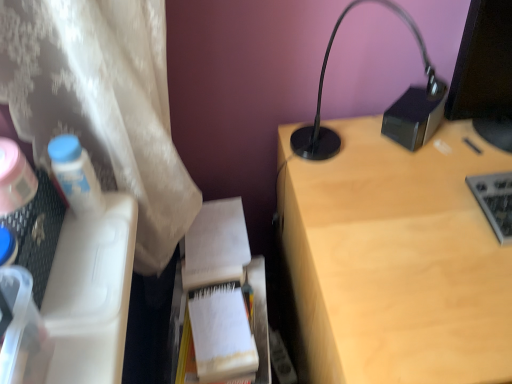
In order to face light wood desk at upper right, should I rotate leftwards or rightwards?

It's best to rotate right around 26.808 degrees.

What do you see at coordinates (485, 73) in the screenshot? I see `black glossy monitor at upper right` at bounding box center [485, 73].

Locate an element on the screen. This screenshot has height=384, width=512. white paper at center is located at coordinates (222, 333).

Describe the element at coordinates (76, 176) in the screenshot. I see `white plastic bottle at left` at that location.

The width and height of the screenshot is (512, 384). What are the coordinates of `light wood desk at upper right` in the screenshot? It's located at tap(395, 259).

Is light wood desk at upper right far away from white paper notebook at center?

They are positioned close to each other.

Which of these two, light wood desk at upper right or white paper notebook at center, is smaller?

white paper notebook at center.

Is light wood desk at upper right completely or partially outside of white paper notebook at center?

That's correct, light wood desk at upper right is outside of white paper notebook at center.

Which of these two, light wood desk at upper right or white paper notebook at center, stands shorter?

white paper notebook at center.

You are a GUI agent. You are given a task and a screenshot of the screen. Output one action in this format:
    pyautogui.click(x=<x>, y=<y>)
    Task: Click on the laptop keyboard below the black matte speaker at upper right (from a real-world perspective)
    Image resolution: width=512 pixels, height=384 pixels.
    Given the screenshot: What is the action you would take?
    pyautogui.click(x=495, y=201)

Consider the image. Is gray metallic keyboard at right completely or partially outside of black matte speaker at upper right?

Yes, gray metallic keyboard at right is outside of black matte speaker at upper right.

Is gray metallic keyboard at right positioned with its back to black matte speaker at upper right?

A: gray metallic keyboard at right is not turned away from black matte speaker at upper right.

Is point (472, 176) closer or farther from the camera than point (388, 110)?

Point (472, 176) is closer to the camera than point (388, 110).

In the scene shown: Can you confirm if white paper at center is positioned to the right of black matte speaker at upper right?

In fact, white paper at center is to the left of black matte speaker at upper right.

Are white paper at center and black matte speaker at upper right located far from each other?

No, white paper at center is in close proximity to black matte speaker at upper right.

Considering the relative sizes of white paper at center and black matte speaker at upper right in the image provided, is white paper at center shorter than black matte speaker at upper right?

Indeed, white paper at center has a lesser height compared to black matte speaker at upper right.

Considering the sizes of black matte speaker at upper right and gray metallic keyboard at right in the image, is black matte speaker at upper right taller or shorter than gray metallic keyboard at right?

Clearly, black matte speaker at upper right is taller compared to gray metallic keyboard at right.

In order to click on speaker located on the left of gray metallic keyboard at right in this screenshot , I will do `click(415, 116)`.

Can you tell me how much black matte speaker at upper right and gray metallic keyboard at right differ in facing direction?

40 degrees.

Which of these two, black matte speaker at upper right or gray metallic keyboard at right, is smaller?

With smaller size is black matte speaker at upper right.

Looking at this image, considering the relative positions of light wood desk at upper right and white paper at center in the image provided, is light wood desk at upper right to the right of white paper at center from the viewer's perspective?

Yes.

Can you tell me how much light wood desk at upper right and white paper at center differ in facing direction?

The angle between the facing direction of light wood desk at upper right and the facing direction of white paper at center is 2.84 degrees.

From a real-world perspective, is light wood desk at upper right on top of white paper at center?

No, from a real-world perspective, light wood desk at upper right is not over white paper at center

Looking at this image, from the image's perspective, is white paper at center positioned above or below light wood desk at upper right?

Clearly, from the image's perspective, white paper at center is below light wood desk at upper right.

From a real-world perspective, which is physically above, white paper at center or light wood desk at upper right?

white paper at center, from a real-world perspective.

Where is `paperback book below the light wood desk at upper right (from the image's perspective)`? This screenshot has width=512, height=384. paperback book below the light wood desk at upper right (from the image's perspective) is located at coordinates (222, 333).

Considering the points (229, 359) and (402, 261), which point is behind, point (229, 359) or point (402, 261)?

The point (229, 359) is behind.

Is white plastic bottle at left positioned behind black matte speaker at upper right?

No, the depth of white plastic bottle at left is less than that of black matte speaker at upper right.

Is black matte speaker at upper right surrounded by white plastic bottle at left?

No, black matte speaker at upper right is located outside of white plastic bottle at left.

How many degrees apart are the facing directions of white plastic bottle at left and black matte speaker at upper right?

The facing directions of white plastic bottle at left and black matte speaker at upper right are 50.9 degrees apart.

Looking at this image, is white plastic bottle at left wider or thinner than black matte speaker at upper right?

In the image, white plastic bottle at left appears to be more narrow than black matte speaker at upper right.

The image size is (512, 384). Find the location of `notebook lying above the light wood desk at upper right (from the image's perspective)`. notebook lying above the light wood desk at upper right (from the image's perspective) is located at coordinates (216, 245).

This screenshot has width=512, height=384. Find the location of `laptop keyboard that appears below the black matte speaker at upper right (from the image's perspective)`. laptop keyboard that appears below the black matte speaker at upper right (from the image's perspective) is located at coordinates (495, 201).

From the image, which object appears to be nearer to light wood desk at upper right, black metallic lamp at upper right or gray metallic keyboard at right?

black metallic lamp at upper right lies closer to light wood desk at upper right than the other object.

When comparing their distances from black glossy monitor at upper right, does gray metallic keyboard at right or black matte speaker at upper right seem further?

gray metallic keyboard at right.

Looking at the image, which one is located further to white plastic bottle at left, white paper at center or gray metallic keyboard at right?

gray metallic keyboard at right lies further to white plastic bottle at left than the other object.

Based on their spatial positions, is gray metallic keyboard at right or black metallic lamp at upper right further from black glossy monitor at upper right?

Based on the image, gray metallic keyboard at right appears to be further to black glossy monitor at upper right.

Estimate the real-world distances between objects in this image. Which object is closer to gray metallic keyboard at right, white plastic bottle at left or light wood desk at upper right?

Based on the image, light wood desk at upper right appears to be nearer to gray metallic keyboard at right.

From the image, which object appears to be farther from black metallic lamp at upper right, gray metallic keyboard at right or light wood desk at upper right?

gray metallic keyboard at right lies further to black metallic lamp at upper right than the other object.

From the image, which object appears to be farther from white plastic bottle at left, black glossy monitor at upper right or white paper at center?

Among the two, black glossy monitor at upper right is located further to white plastic bottle at left.

Which object lies nearer to the anchor point black metallic lamp at upper right, black glossy monitor at upper right or black matte speaker at upper right?

black matte speaker at upper right lies closer to black metallic lamp at upper right than the other object.

Find the location of a particular element. notebook situated between white plastic bottle at left and black metallic lamp at upper right from left to right is located at coordinates (216, 245).

Image resolution: width=512 pixels, height=384 pixels. In order to click on notebook between white plastic bottle at left and light wood desk at upper right from left to right in this screenshot , I will do `click(216, 245)`.

The image size is (512, 384). I want to click on lamp between white paper at center and black glossy monitor at upper right, so click(x=386, y=110).

You are a GUI agent. You are given a task and a screenshot of the screen. Output one action in this format:
    pyautogui.click(x=<x>, y=<y>)
    Task: Click on the paperback book between white paper notebook at center and black glossy monitor at upper right from left to right
    This screenshot has height=384, width=512.
    Given the screenshot: What is the action you would take?
    pyautogui.click(x=222, y=333)